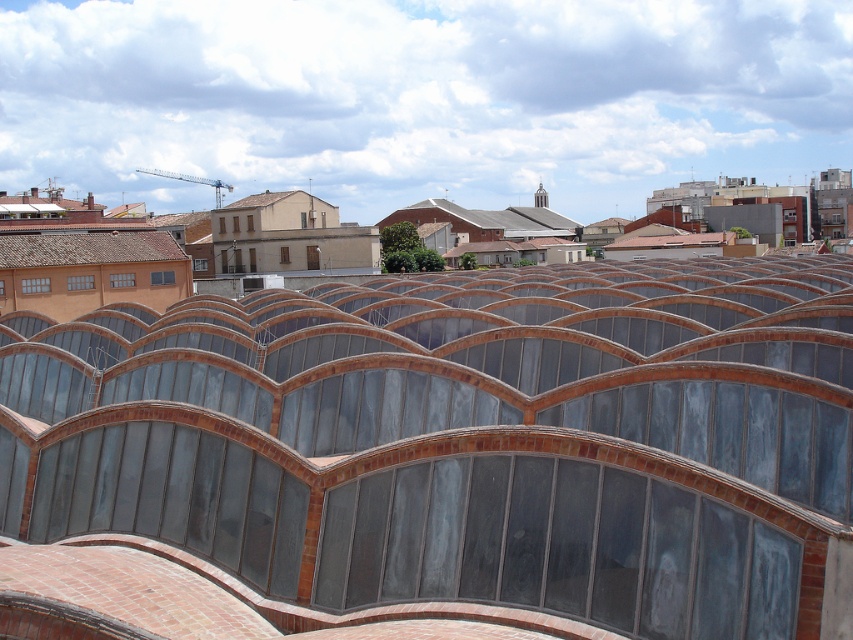
Who is more forward, (601,456) or (99,259)?

Point (601,456)

Between point (306, 529) and point (170, 256), which one is positioned behind?

The point (170, 256) is behind.

Who is more distant from viewer, (616,307) or (15,252)?

Positioned behind is point (15,252).

This screenshot has height=640, width=853. Find the location of `brown brick tile roof at center`. brown brick tile roof at center is located at coordinates (439, 456).